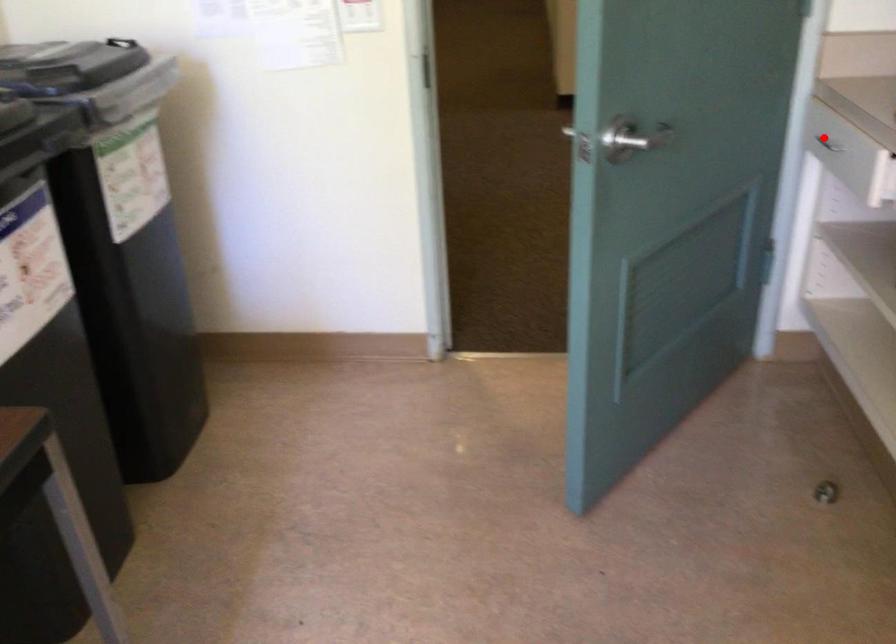
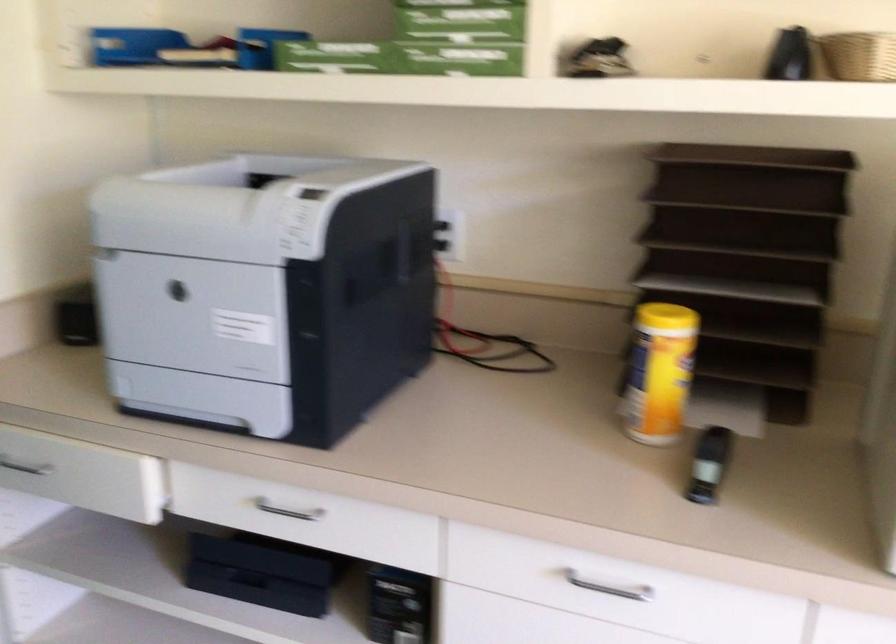
Question: I am providing you with two images of the same scene from different viewpoints. In image1, a red point is highlighted. Considering the same 3D point in image2, which of the following is correct?

Choices:
 (A) It is closer
 (B) It is farther

Answer: (A)